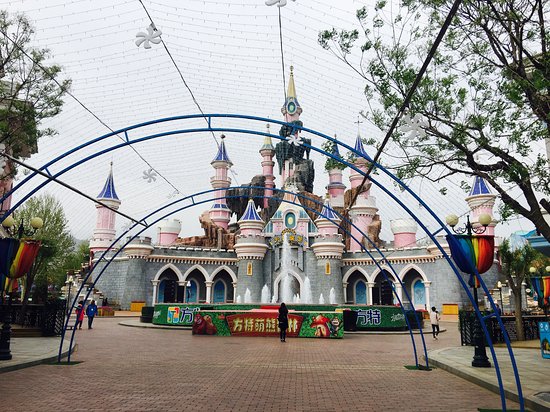
The width and height of the screenshot is (550, 412). I want to click on decorative snowflakes, so click(x=146, y=176), click(x=146, y=34), click(x=283, y=2), click(x=416, y=128), click(x=173, y=196), click(x=357, y=216), click(x=294, y=138).